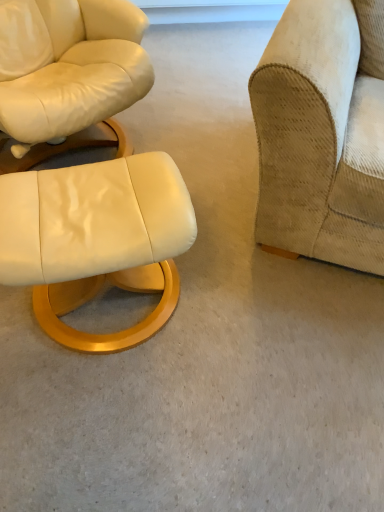
Locate an element on the screen. free point in front of matte white leather ottoman at lower left is located at coordinates (115, 422).